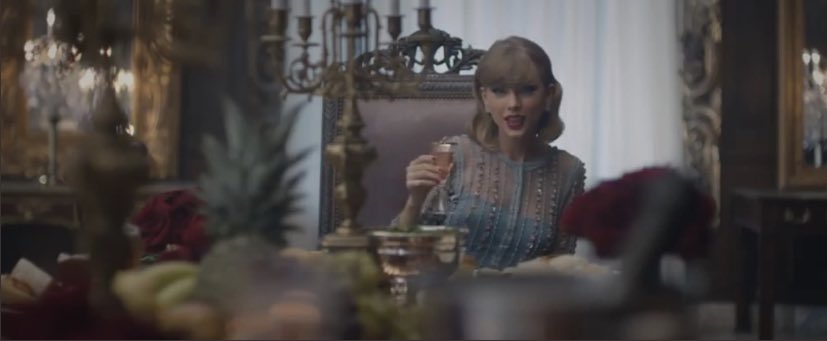
Locate an element on the screen. wine glass is located at coordinates (445, 155).